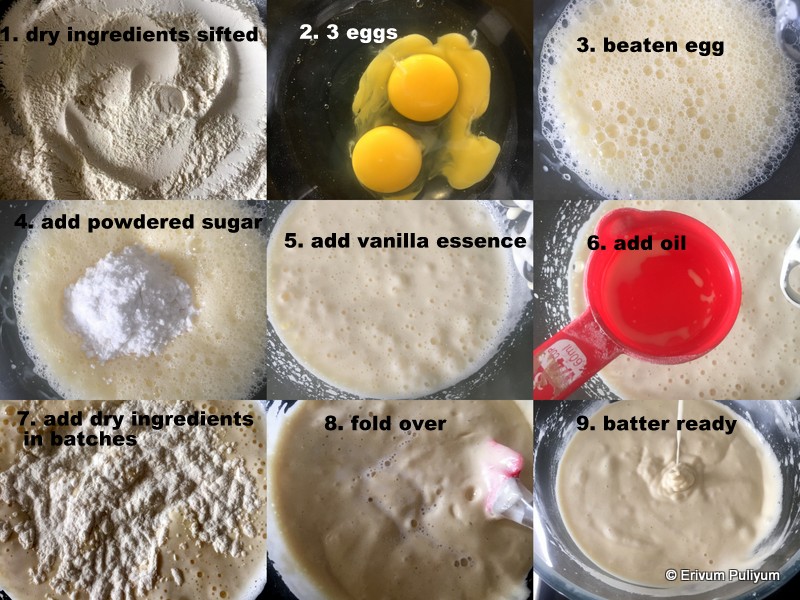
What are the coordinates of `measuring cup handle` in the screenshot? It's located at (560, 370).